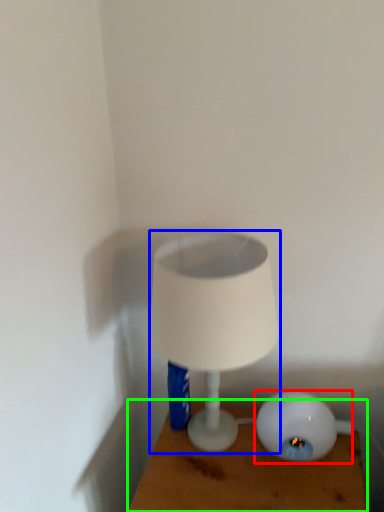
Question: Considering the real-world distances, which object is farthest from lamp (highlighted by a red box)? lamp (highlighted by a blue box) or furniture (highlighted by a green box)?

Choices:
 (A) lamp
 (B) furniture

Answer: (A)